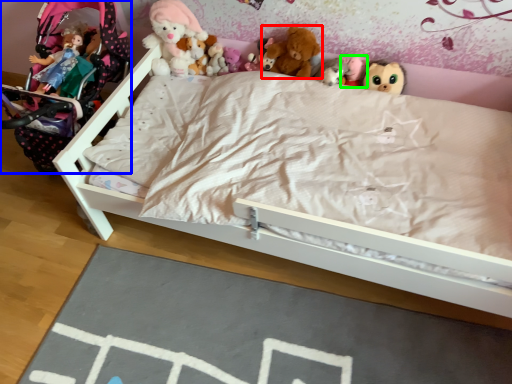
Question: Which is nearer to the toy (highlighted by a red box)? baby carriage (highlighted by a blue box) or toy (highlighted by a green box).

Choices:
 (A) baby carriage
 (B) toy

Answer: (B)